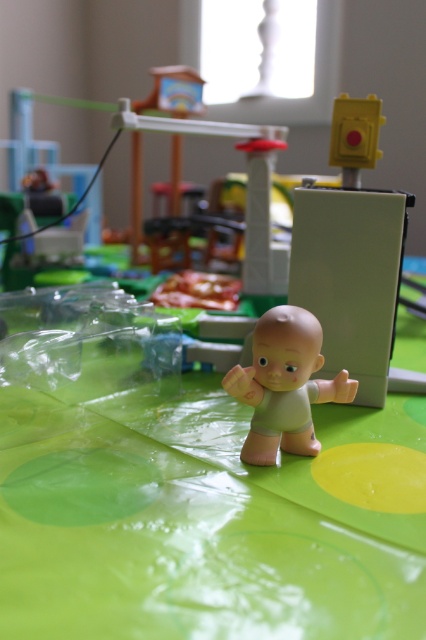
Is green plastic table at center behind smooth beige baby at center?

No.

Which is in front, point (141, 580) or point (291, 413)?

Positioned in front is point (141, 580).

Identify the location of green plastic table at center. This screenshot has width=426, height=640. (173, 508).